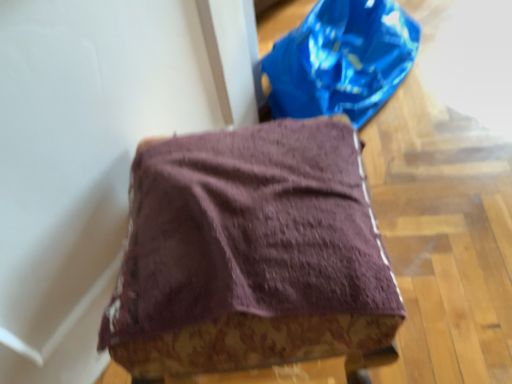
Measure the distance between point [242,295] and camera.

The distance of point [242,295] from camera is 18.86 inches.

The width and height of the screenshot is (512, 384). Identify the location of purple fabric-covered stool at center. (250, 254).

What do you see at coordinates (250, 254) in the screenshot? The image size is (512, 384). I see `purple fabric-covered stool at center` at bounding box center [250, 254].

What are the coordinates of `purple fabric-covered stool at center` in the screenshot? It's located at (250, 254).